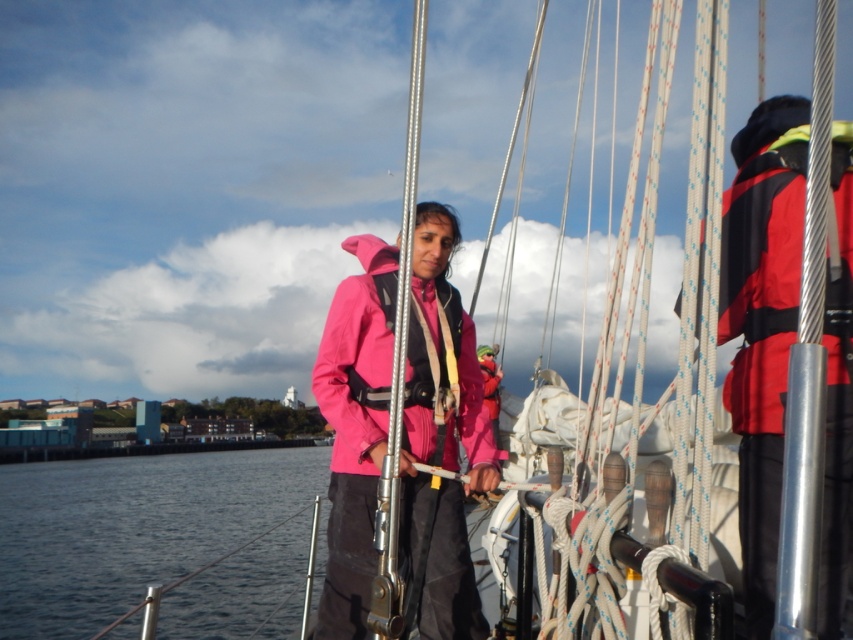
The width and height of the screenshot is (853, 640). Describe the element at coordinates (762, 264) in the screenshot. I see `red synthetic jacket at right` at that location.

Is red synthetic jacket at right below matte pink jacket at center?

Indeed, red synthetic jacket at right is positioned under matte pink jacket at center.

Find the location of a particular element. Image resolution: width=853 pixels, height=640 pixels. red synthetic jacket at right is located at coordinates (762, 264).

Who is lower down, dark blue water at lower left or matte pink jacket at center?

Positioned lower is dark blue water at lower left.

Does dark blue water at lower left have a greater height compared to matte pink jacket at center?

Yes.

You are a GUI agent. You are given a task and a screenshot of the screen. Output one action in this format:
    pyautogui.click(x=<x>, y=<y>)
    Task: Click on the dark blue water at lower left
    The image size is (853, 640).
    Given the screenshot: What is the action you would take?
    point(131,528)

The image size is (853, 640). I want to click on dark blue water at lower left, so click(131, 528).

Is the position of dark blue water at lower left more distant than that of red synthetic jacket at right?

Yes, dark blue water at lower left is further from the viewer.

This screenshot has width=853, height=640. Identify the location of dark blue water at lower left. (131, 528).